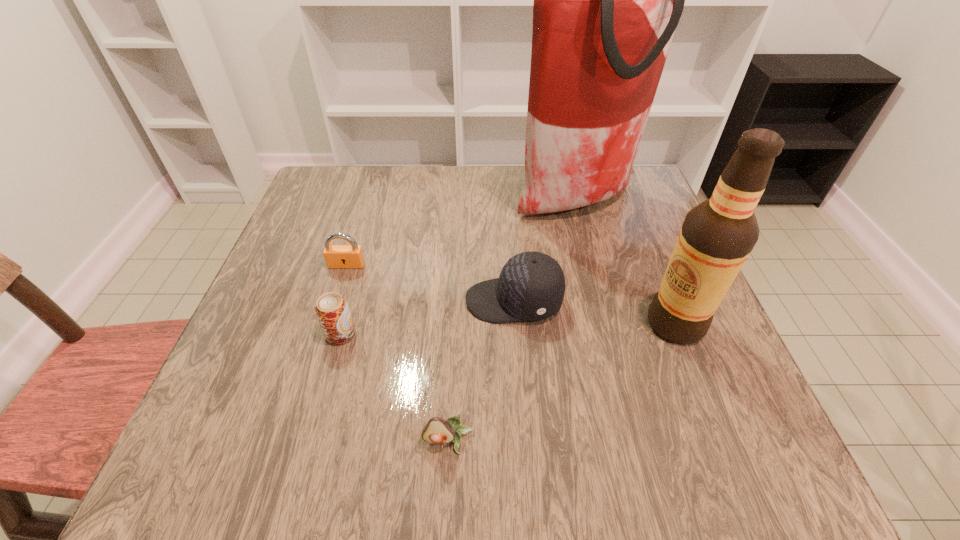
The image size is (960, 540). Find the location of `grocery bag located at the right edge`. grocery bag located at the right edge is located at coordinates (607, 0).

At what (x,y) coordinates should I click in order to perform the action: click on alcohol located at the right edge. Please return your answer as a coordinate pair (x, y). The image size is (960, 540). Looking at the image, I should click on (717, 236).

Find the location of a particular element. object located at the far right corner is located at coordinates (607, 0).

Locate an element on the screen. The image size is (960, 540). vacant area at the far edge is located at coordinates (492, 183).

Identify the location of vacant space at the left edge of the desktop. The width and height of the screenshot is (960, 540). (276, 285).

In the image, there is a desktop. Identify the location of vacant space at the right edge. The image size is (960, 540). (643, 339).

Identify the location of vacant space at the far left corner of the desktop. The image size is (960, 540). (358, 177).

Where is `vacant space at the near left corner`? Image resolution: width=960 pixels, height=540 pixels. vacant space at the near left corner is located at coordinates (223, 449).

This screenshot has width=960, height=540. In order to click on free region at the far right corner of the desktop in this screenshot , I will do `click(633, 181)`.

Where is `vacant area at the near right corner`? The image size is (960, 540). vacant area at the near right corner is located at coordinates (763, 456).